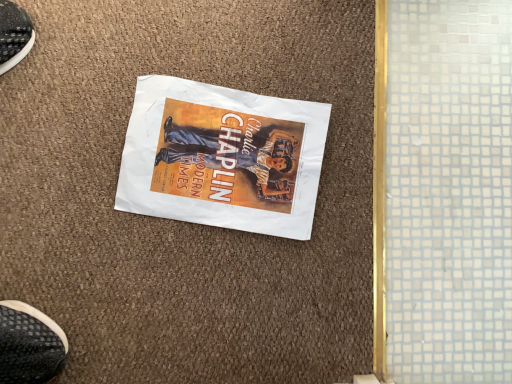
Looking at this image, what is the approximate height of matte paper poster at center?

It is 0.56 inches.

The height and width of the screenshot is (384, 512). What do you see at coordinates (222, 157) in the screenshot?
I see `matte paper poster at center` at bounding box center [222, 157].

The image size is (512, 384). In order to click on matte paper poster at center in this screenshot , I will do `click(222, 157)`.

In order to click on matte paper poster at center in this screenshot , I will do `click(222, 157)`.